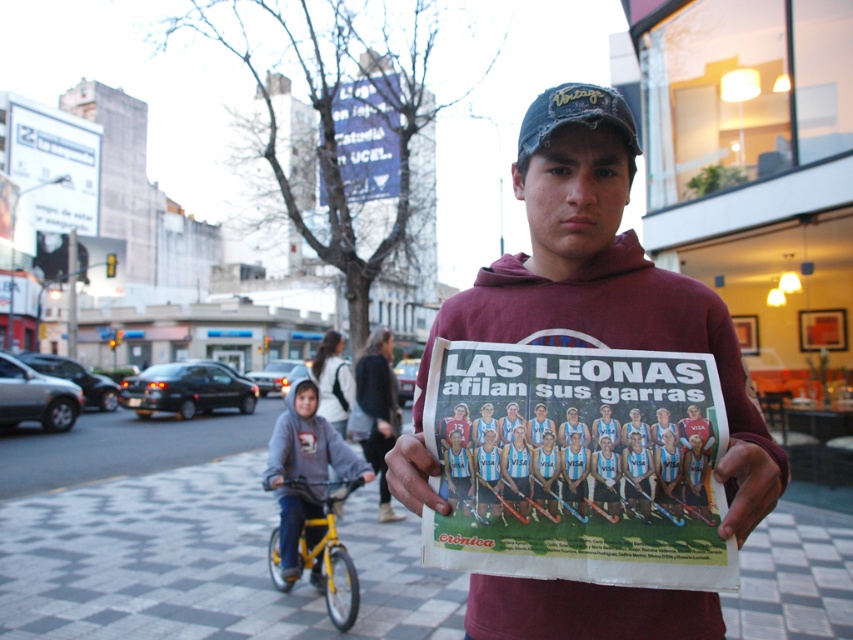
Question: Which point is closer to the camera?

Choices:
 (A) smooth skin hand at center
 (B) smooth paper hand at center
 (C) gray hoodie at lower left

Answer: (A)

Question: Which is nearer to the gray hoodie at lower left?

Choices:
 (A) smooth skin hand at center
 (B) maroon hoodie at center
 (C) white paper poster at center
 (D) distressed denim baseball cap at center

Answer: (D)

Question: Considering the relative positions of white paper poster at center and gray hoodie at lower left in the image provided, where is white paper poster at center located with respect to gray hoodie at lower left?

Choices:
 (A) above
 (B) below

Answer: (A)

Question: Observing the image, what is the correct spatial positioning of white paper poster at center in reference to smooth paper hand at center?

Choices:
 (A) right
 (B) left

Answer: (A)

Question: Which object appears closest to the camera in this image?

Choices:
 (A) distressed denim baseball cap at center
 (B) maroon hoodie at center
 (C) gray hoodie at lower left
 (D) smooth skin hand at center

Answer: (D)

Question: Is maroon hoodie at center to the right of distressed denim baseball cap at center from the viewer's perspective?

Choices:
 (A) yes
 (B) no

Answer: (B)